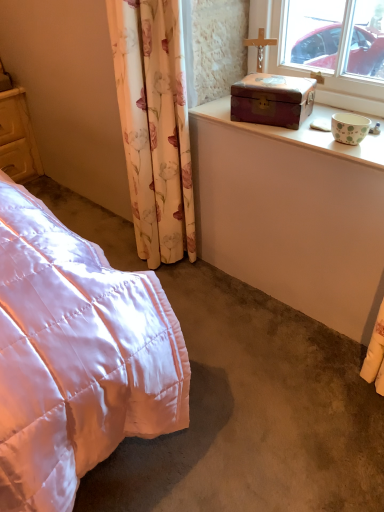
Question: Could matte yellow wooden cupboard at left be considered to be inside wooden box at upper right?

Choices:
 (A) no
 (B) yes

Answer: (A)

Question: Is wooden box at upper right shorter than matte yellow wooden cupboard at left?

Choices:
 (A) no
 (B) yes

Answer: (B)

Question: Is wooden box at upper right outside matte yellow wooden cupboard at left?

Choices:
 (A) no
 (B) yes

Answer: (B)

Question: Does wooden box at upper right have a greater width compared to matte yellow wooden cupboard at left?

Choices:
 (A) yes
 (B) no

Answer: (B)

Question: Is wooden box at upper right turned away from matte yellow wooden cupboard at left?

Choices:
 (A) no
 (B) yes

Answer: (A)

Question: From the image's perspective, is wooden box at upper right above or below matte yellow wooden cupboard at left?

Choices:
 (A) below
 (B) above

Answer: (A)

Question: From their relative heights in the image, would you say wooden box at upper right is taller or shorter than matte yellow wooden cupboard at left?

Choices:
 (A) tall
 (B) short

Answer: (B)

Question: Would you say wooden box at upper right is inside or outside matte yellow wooden cupboard at left?

Choices:
 (A) outside
 (B) inside

Answer: (A)

Question: Relative to matte yellow wooden cupboard at left, is wooden box at upper right in front or behind?

Choices:
 (A) front
 (B) behind

Answer: (A)

Question: Would you say floral fabric curtain at left is to the left or to the right of matte yellow wooden cupboard at left in the picture?

Choices:
 (A) left
 (B) right

Answer: (B)

Question: Is point (180, 75) closer or farther from the camera than point (31, 138)?

Choices:
 (A) farther
 (B) closer

Answer: (B)

Question: Is floral fabric curtain at left wider or thinner than matte yellow wooden cupboard at left?

Choices:
 (A) thin
 (B) wide

Answer: (A)

Question: Is floral fabric curtain at left spatially inside matte yellow wooden cupboard at left, or outside of it?

Choices:
 (A) inside
 (B) outside

Answer: (B)

Question: Based on their positions, is wooden box at upper right located to the left or right of floral fabric curtain at left?

Choices:
 (A) right
 (B) left

Answer: (A)

Question: In terms of width, does wooden box at upper right look wider or thinner when compared to floral fabric curtain at left?

Choices:
 (A) wide
 (B) thin

Answer: (B)